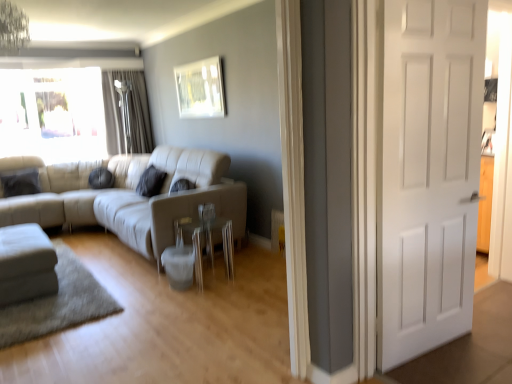
Question: Which direction should I rotate to look at beige leather couch at center, which is the 2th studio couch in left-to-right order, — up or down?

Choices:
 (A) up
 (B) down

Answer: (B)

Question: Considering the relative sizes of metallic silver picture frame at upper center and dark gray fabric curtain at upper left in the image provided, is metallic silver picture frame at upper center taller than dark gray fabric curtain at upper left?

Choices:
 (A) no
 (B) yes

Answer: (A)

Question: From the image's perspective, is metallic silver picture frame at upper center on dark gray fabric curtain at upper left?

Choices:
 (A) yes
 (B) no

Answer: (A)

Question: Is the position of metallic silver picture frame at upper center less distant than that of dark gray fabric curtain at upper left?

Choices:
 (A) yes
 (B) no

Answer: (A)

Question: Is the position of metallic silver picture frame at upper center more distant than that of dark gray fabric curtain at upper left?

Choices:
 (A) yes
 (B) no

Answer: (B)

Question: From a real-world perspective, is metallic silver picture frame at upper center beneath dark gray fabric curtain at upper left?

Choices:
 (A) yes
 (B) no

Answer: (B)

Question: Considering the relative positions of metallic silver picture frame at upper center and dark gray fabric curtain at upper left in the image provided, is metallic silver picture frame at upper center to the right of dark gray fabric curtain at upper left from the viewer's perspective?

Choices:
 (A) no
 (B) yes

Answer: (B)

Question: Is dark gray fabric curtain at upper left positioned before metallic silver picture frame at upper center?

Choices:
 (A) no
 (B) yes

Answer: (A)

Question: Considering the relative sizes of dark gray fabric curtain at upper left and metallic silver picture frame at upper center in the image provided, is dark gray fabric curtain at upper left wider than metallic silver picture frame at upper center?

Choices:
 (A) no
 (B) yes

Answer: (B)

Question: Can metallic silver picture frame at upper center be found inside dark gray fabric curtain at upper left?

Choices:
 (A) no
 (B) yes

Answer: (A)

Question: Considering the relative sizes of dark gray fabric curtain at upper left and metallic silver picture frame at upper center in the image provided, is dark gray fabric curtain at upper left thinner than metallic silver picture frame at upper center?

Choices:
 (A) yes
 (B) no

Answer: (B)

Question: Does dark gray fabric curtain at upper left have a smaller size compared to metallic silver picture frame at upper center?

Choices:
 (A) yes
 (B) no

Answer: (B)

Question: Is dark gray fabric curtain at upper left positioned with its back to metallic silver picture frame at upper center?

Choices:
 (A) yes
 (B) no

Answer: (B)

Question: Are clear glass side table at center and dark gray fabric curtain at upper left located far from each other?

Choices:
 (A) yes
 (B) no

Answer: (A)